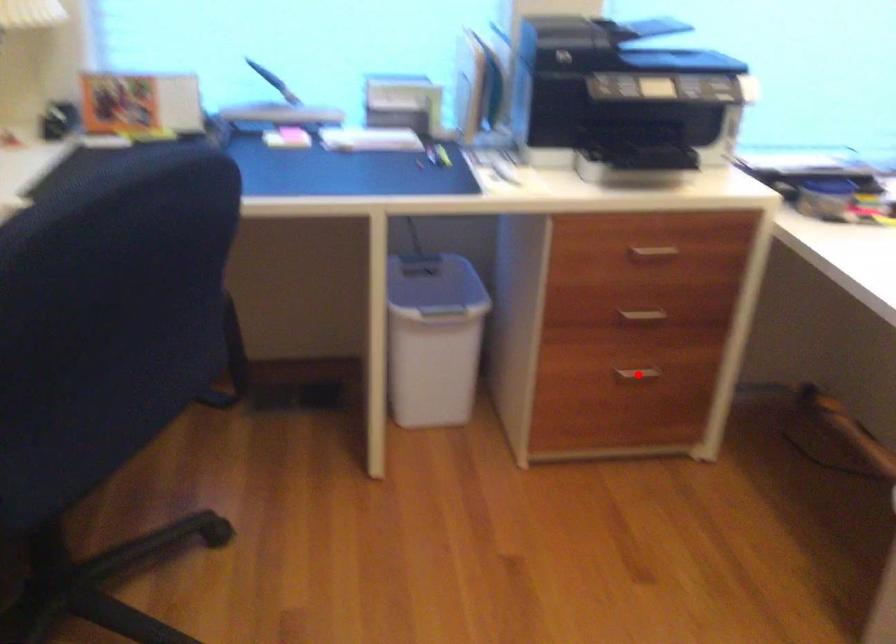
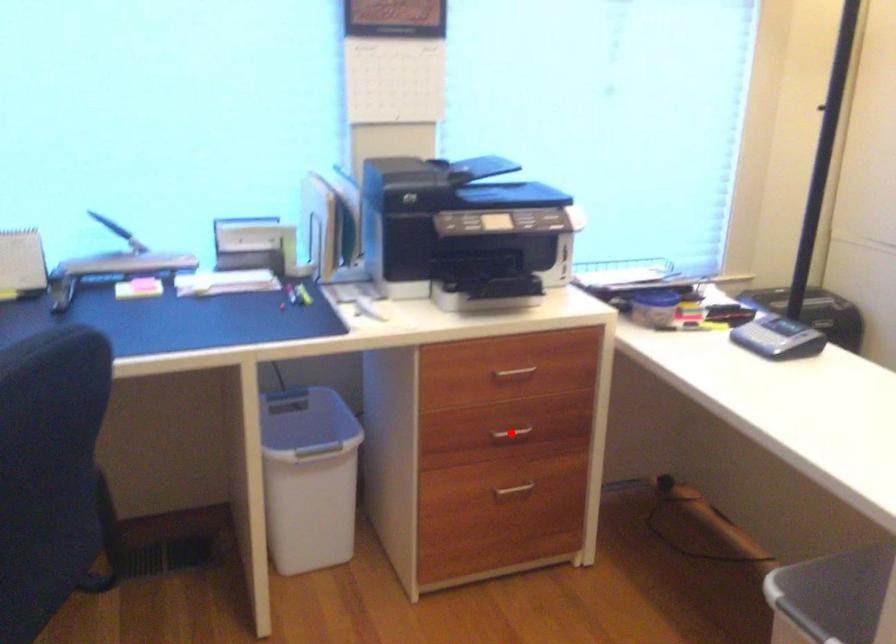
I am providing you with two images of the same scene from different viewpoints. A red point is marked on the first image and another point is marked on the second image. Does the point marked in image1 correspond to the same location as the one in image2?

No